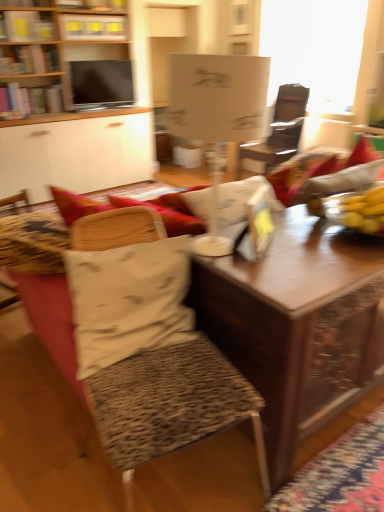
Locate an element on the screen. The height and width of the screenshot is (512, 384). free point in front of white matte lampshade at center is located at coordinates (279, 279).